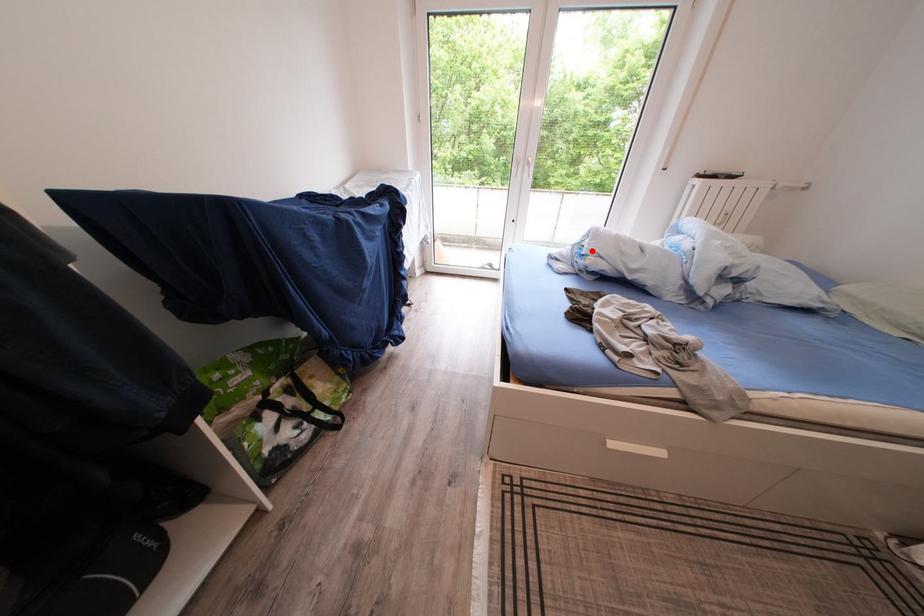
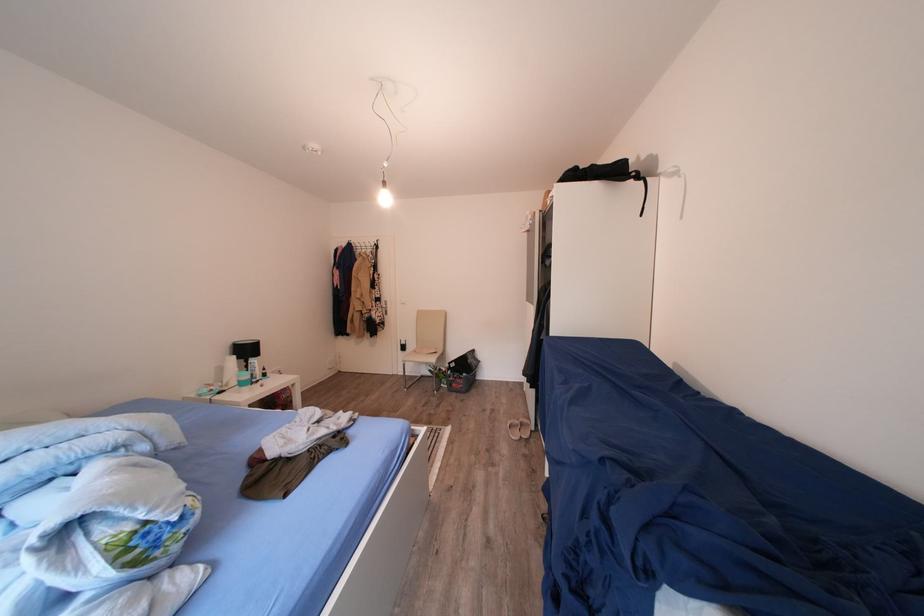
The point at the highlighted location is marked in the first image. Where is the corresponding point in the second image?

(142, 538)